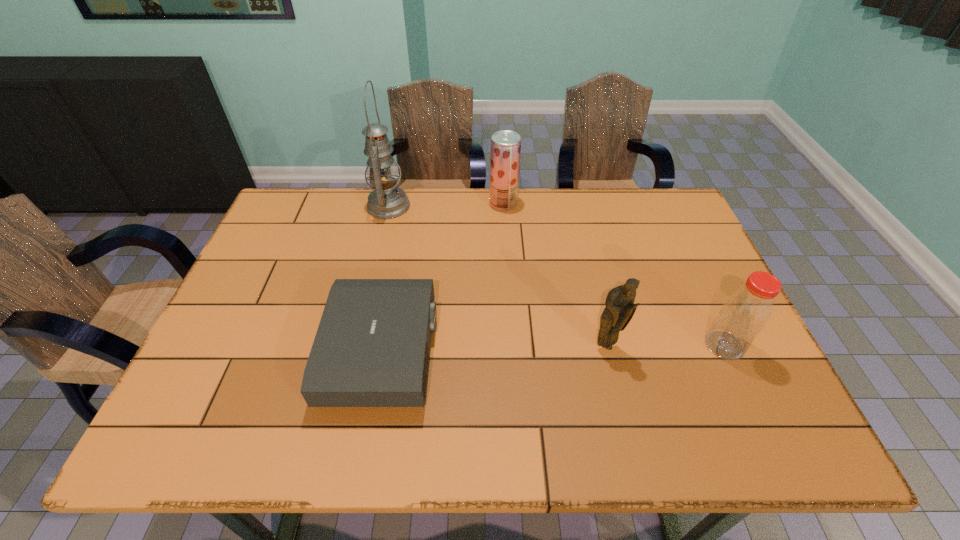
Find the location of a particular element. The width and height of the screenshot is (960, 540). free space between the rightmost object and the shortest object is located at coordinates (553, 349).

Locate an element on the screen. vacant space that's between the bottle and the shortest object is located at coordinates (553, 349).

Identify the location of unoccupied position between the third object from left to right and the figurine. (555, 275).

The image size is (960, 540). I want to click on free space that is in between the projector and the fruit juice, so click(443, 278).

Identify the location of free space between the fruit juice and the projector. The image size is (960, 540). (443, 278).

Identify the location of unoccupied area between the fourth object from left to right and the projector. The height and width of the screenshot is (540, 960). (494, 349).

This screenshot has width=960, height=540. In order to click on free space that is in between the fruit juice and the oil lamp in this screenshot , I will do `click(445, 205)`.

I want to click on free space between the tallest object and the figurine, so click(x=497, y=276).

This screenshot has height=540, width=960. In order to click on free point between the bottle and the oil lamp in this screenshot , I will do `click(557, 275)`.

Locate which object is the second closest to the tallest object. Please provide its 2D coordinates. Your answer should be formatted as a tuple, i.e. [(x, y)], where the tuple contains the x and y coordinates of a point satisfying the conditions above.

[(372, 346)]